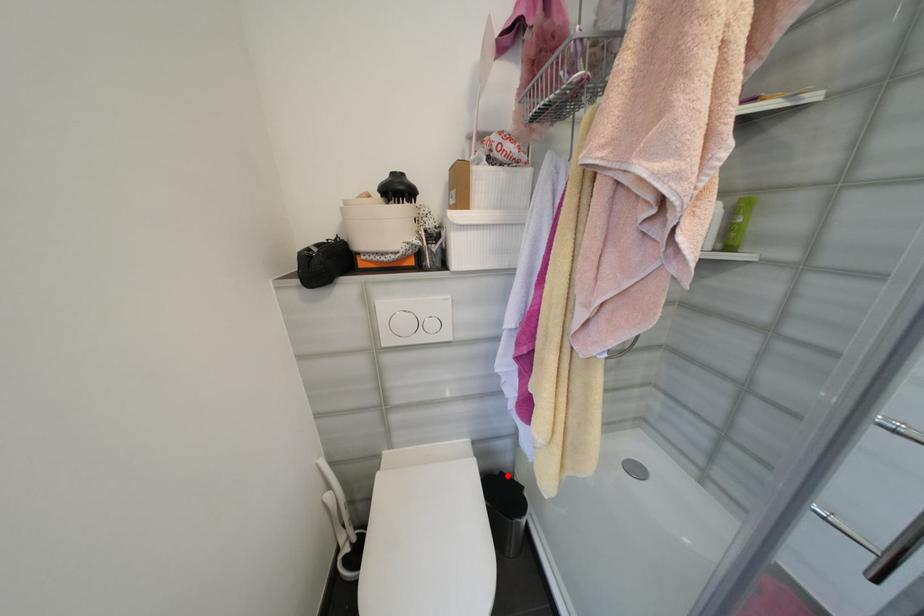
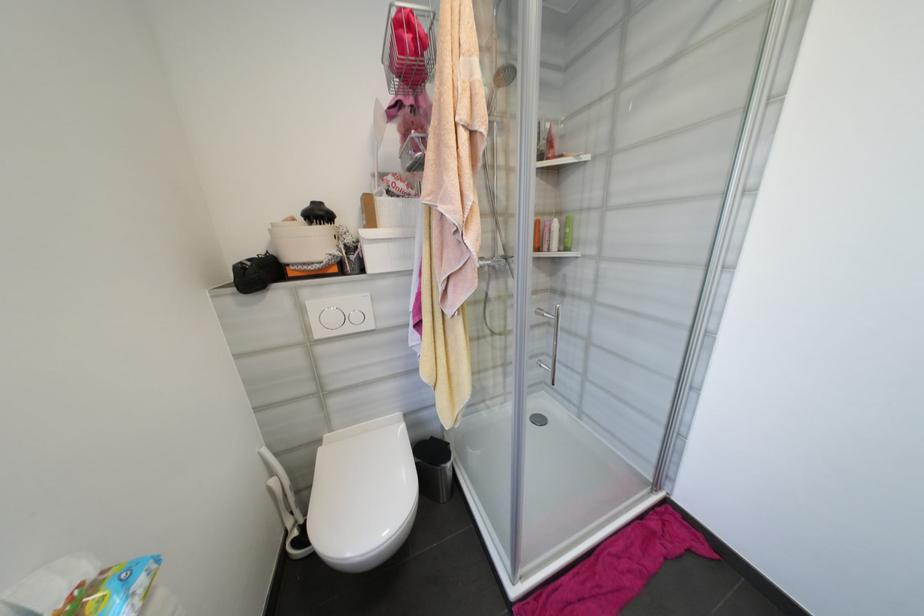
Question: I am providing you with two images of the same scene from different viewpoints. In image1, a red point is highlighted. Considering the same 3D point in image2, which of the following is correct?

Choices:
 (A) It is closer
 (B) It is farther

Answer: (B)